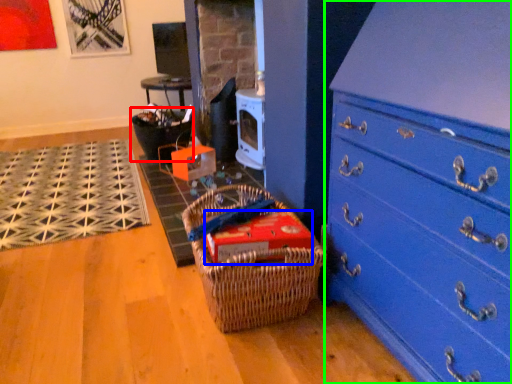
Question: Which object is positioned closest to basket (highlighted by a red box)? Select from storage box (highlighted by a blue box) and chest of drawers (highlighted by a green box).

Choices:
 (A) storage box
 (B) chest of drawers

Answer: (A)